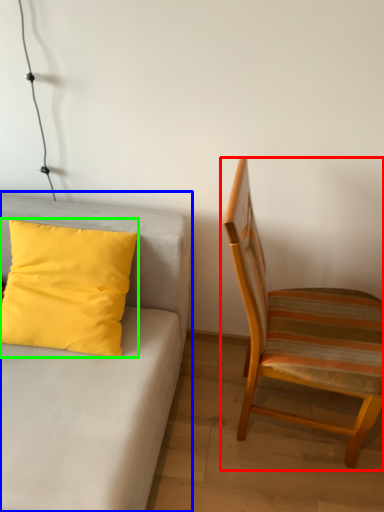
Question: Which object is the closest to the chair (highlighted by a red box)? Choose among these: studio couch (highlighted by a blue box) or pillow (highlighted by a green box).

Choices:
 (A) studio couch
 (B) pillow

Answer: (A)